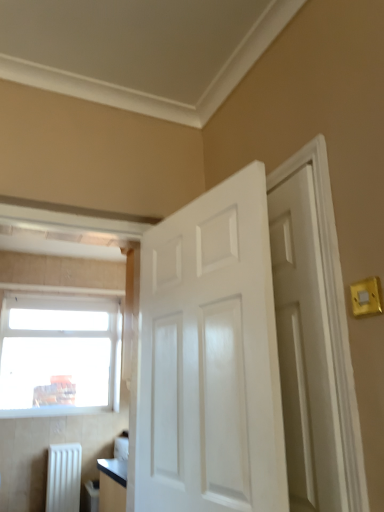
Question: Can you confirm if white glossy door at right, which is counted as the 2th door, starting from the left, is smaller than yellow plastic light switch at upper right?

Choices:
 (A) yes
 (B) no

Answer: (B)

Question: Is the depth of white glossy door at right, placed as the first door when sorted from right to left, greater than that of yellow plastic light switch at upper right?

Choices:
 (A) yes
 (B) no

Answer: (B)

Question: Is white glossy door at right, placed as the first door when sorted from right to left, directly adjacent to yellow plastic light switch at upper right?

Choices:
 (A) yes
 (B) no

Answer: (B)

Question: Does white glossy door at right, which is counted as the 2th door, starting from the left, have a greater width compared to yellow plastic light switch at upper right?

Choices:
 (A) yes
 (B) no

Answer: (A)

Question: Would you say white glossy door at right, which is counted as the 2th door, starting from the left, is outside yellow plastic light switch at upper right?

Choices:
 (A) yes
 (B) no

Answer: (A)

Question: Can you confirm if white glossy door at right, which is counted as the 2th door, starting from the left, is positioned to the left of yellow plastic light switch at upper right?

Choices:
 (A) yes
 (B) no

Answer: (A)

Question: Is yellow plastic light switch at upper right taller than white matte radiator at lower left?

Choices:
 (A) yes
 (B) no

Answer: (B)

Question: Is yellow plastic light switch at upper right positioned in front of white matte radiator at lower left?

Choices:
 (A) no
 (B) yes

Answer: (B)

Question: Is yellow plastic light switch at upper right far away from white matte radiator at lower left?

Choices:
 (A) yes
 (B) no

Answer: (A)

Question: Is yellow plastic light switch at upper right turned away from white matte radiator at lower left?

Choices:
 (A) no
 (B) yes

Answer: (A)

Question: Considering the relative sizes of yellow plastic light switch at upper right and white matte radiator at lower left in the image provided, is yellow plastic light switch at upper right wider than white matte radiator at lower left?

Choices:
 (A) no
 (B) yes

Answer: (A)

Question: From a real-world perspective, is yellow plastic light switch at upper right on top of white matte radiator at lower left?

Choices:
 (A) yes
 (B) no

Answer: (A)

Question: Is white glossy door at right, which is counted as the 2th door, starting from the left, far from white matte radiator at lower left?

Choices:
 (A) no
 (B) yes

Answer: (B)